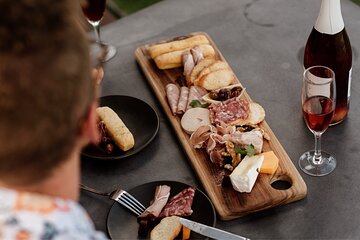
This screenshot has height=240, width=360. I want to click on rectangular cutting board, so click(x=182, y=133).